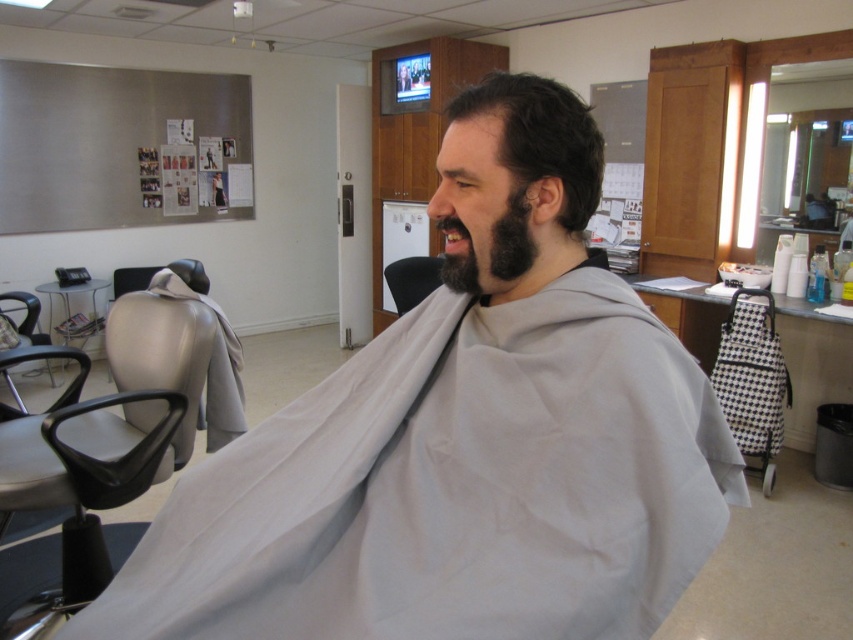
Does dark brown hair at center appear over black plastic chair at left?

Yes.

Is dark brown hair at center wider than black plastic chair at left?

No.

Is point (556, 164) in front of point (48, 340)?

That is True.

You are a GUI agent. You are given a task and a screenshot of the screen. Output one action in this format:
    pyautogui.click(x=<x>, y=<y>)
    Task: Click on the dark brown hair at center
    The image size is (853, 640).
    Given the screenshot: What is the action you would take?
    pyautogui.click(x=538, y=144)

Is black fuzzy beard at center behind black leather chair at center?

No.

Is point (490, 280) behind point (389, 282)?

No.

Who is more forward, (492, 291) or (428, 268)?

Point (492, 291)

Identify the location of black fuzzy beard at center. Image resolution: width=853 pixels, height=640 pixels. (488, 246).

Between matte gray chair at left and black leather chair at center, which one appears on the right side from the viewer's perspective?

From the viewer's perspective, black leather chair at center appears more on the right side.

Is matte gray chair at left to the left of black leather chair at center from the viewer's perspective?

Yes, matte gray chair at left is to the left of black leather chair at center.

Is point (178, 401) in front of point (431, 284)?

Yes, it is in front of point (431, 284).

Where is `matte gray chair at left`? Image resolution: width=853 pixels, height=640 pixels. matte gray chair at left is located at coordinates pyautogui.click(x=102, y=456).